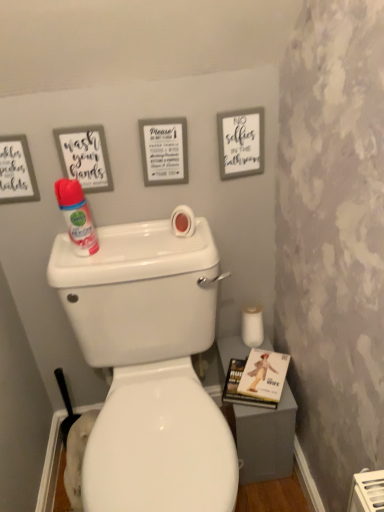
Question: Is pink matte toilet paper at upper center, marked as the second toilet paper in a bottom-to-top arrangement, not near matte white sign at upper center, which is the second picture frame from right to left?

Choices:
 (A) yes
 (B) no

Answer: (B)

Question: Is pink matte toilet paper at upper center, which is counted as the second toilet paper, starting from the back, wider than matte white sign at upper center, which is the second picture frame from right to left?

Choices:
 (A) no
 (B) yes

Answer: (B)

Question: Considering the relative sizes of pink matte toilet paper at upper center, arranged as the 1th toilet paper when viewed from the top, and matte white sign at upper center, which is the second picture frame from right to left, in the image provided, is pink matte toilet paper at upper center, arranged as the 1th toilet paper when viewed from the top, smaller than matte white sign at upper center, which is the second picture frame from right to left,?

Choices:
 (A) no
 (B) yes

Answer: (B)

Question: Considering the relative positions of pink matte toilet paper at upper center, which is counted as the second toilet paper, starting from the back, and matte white sign at upper center, arranged as the second picture frame when viewed from the left, in the image provided, is pink matte toilet paper at upper center, which is counted as the second toilet paper, starting from the back, to the left of matte white sign at upper center, arranged as the second picture frame when viewed from the left, from the viewer's perspective?

Choices:
 (A) yes
 (B) no

Answer: (B)

Question: Would you say matte white sign at upper center, arranged as the second picture frame when viewed from the left, is part of pink matte toilet paper at upper center, which is counted as the first toilet paper, starting from the front,'s contents?

Choices:
 (A) no
 (B) yes

Answer: (A)

Question: Considering their positions, is white matte sign at upper right, the first picture frame viewed from the right, located in front of or behind white matte toilet paper at lower right, the 1th toilet paper ordered from the bottom?

Choices:
 (A) behind
 (B) front

Answer: (B)

Question: Does point pos(240,132) appear closer or farther from the camera than point pos(246,345)?

Choices:
 (A) closer
 (B) farther

Answer: (A)

Question: From their relative heights in the image, would you say white matte sign at upper right, the 3th picture frame positioned from the left, is taller or shorter than white matte toilet paper at lower right, which is the second toilet paper in front-to-back order?

Choices:
 (A) short
 (B) tall

Answer: (B)

Question: Is white matte sign at upper right, the 3th picture frame positioned from the left, inside the boundaries of white matte toilet paper at lower right, which is the second toilet paper in front-to-back order, or outside?

Choices:
 (A) inside
 (B) outside

Answer: (B)

Question: Is point (76, 181) positioned closer to the camera than point (177, 165)?

Choices:
 (A) closer
 (B) farther

Answer: (A)

Question: Relative to matte white sign at upper center, which is the second picture frame from right to left, is matte pink spray bottle at left in front or behind?

Choices:
 (A) front
 (B) behind

Answer: (A)

Question: In the image, is matte pink spray bottle at left on the left side or the right side of matte white sign at upper center, which is the second picture frame from right to left?

Choices:
 (A) right
 (B) left

Answer: (B)

Question: Is matte pink spray bottle at left taller or shorter than matte white sign at upper center, which is the second picture frame from right to left?

Choices:
 (A) tall
 (B) short

Answer: (A)

Question: From a real-world perspective, is matte white sign at upper center, arranged as the second picture frame when viewed from the left, physically located above or below hardcover book at lower right?

Choices:
 (A) above
 (B) below

Answer: (A)

Question: Is point pos(157,135) positioned closer to the camera than point pos(264,390)?

Choices:
 (A) farther
 (B) closer

Answer: (B)